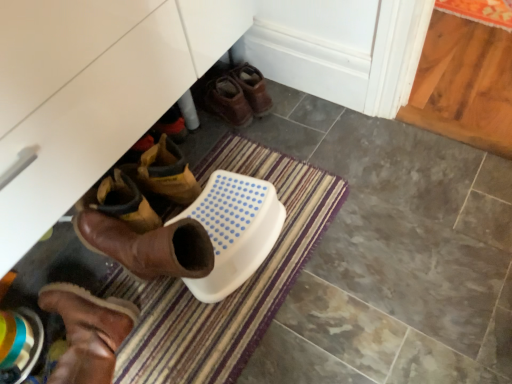
Locate an element on the screen. Image resolution: width=512 pixels, height=384 pixels. space that is in front of brown leather boots at center, which is the 2th footwear in bottom-to-top order is located at coordinates (264, 132).